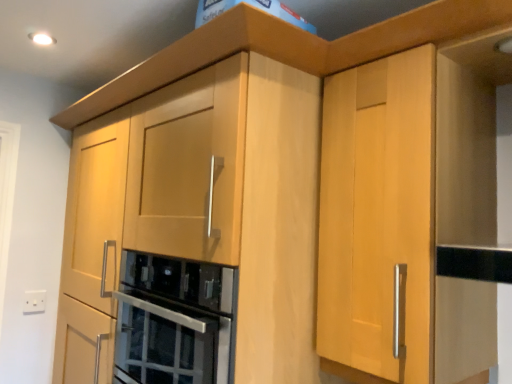
What do you see at coordinates (34, 301) in the screenshot?
I see `white plastic electric outlet at lower left` at bounding box center [34, 301].

At what (x,y) coordinates should I click in order to perform the action: click on white plastic electric outlet at lower left. Please return your answer as a coordinate pair (x, y). The width and height of the screenshot is (512, 384). Looking at the image, I should click on (34, 301).

What do you see at coordinates (175, 321) in the screenshot?
I see `stainless steel oven at center` at bounding box center [175, 321].

The width and height of the screenshot is (512, 384). Find the location of `stainless steel oven at center`. stainless steel oven at center is located at coordinates (175, 321).

Find the location of a particular element. white plastic electric outlet at lower left is located at coordinates (34, 301).

Is white plastic electric outlet at lower left to the left or to the right of stainless steel oven at center in the image?

white plastic electric outlet at lower left is to the left of stainless steel oven at center.

Which object is closer to the camera, white plastic electric outlet at lower left or stainless steel oven at center?

stainless steel oven at center is closer to the camera.

Does point (35, 296) come in front of point (150, 376)?

No, (35, 296) is further to viewer.

From the image's perspective, which object appears higher, white plastic electric outlet at lower left or stainless steel oven at center?

stainless steel oven at center is shown above in the image.

Consider the image. From a real-world perspective, between white plastic electric outlet at lower left and stainless steel oven at center, who is vertically higher?

stainless steel oven at center is physically above.

Considering the sizes of objects white plastic electric outlet at lower left and stainless steel oven at center in the image provided, who is wider, white plastic electric outlet at lower left or stainless steel oven at center?

stainless steel oven at center is wider.

Can you confirm if white plastic electric outlet at lower left is taller than stainless steel oven at center?

No, white plastic electric outlet at lower left is not taller than stainless steel oven at center.

Can you confirm if white plastic electric outlet at lower left is smaller than stainless steel oven at center?

Indeed, white plastic electric outlet at lower left has a smaller size compared to stainless steel oven at center.

Is white plastic electric outlet at lower left positioned beyond the bounds of stainless steel oven at center?

white plastic electric outlet at lower left lies outside stainless steel oven at center's area.

Does white plastic electric outlet at lower left touch stainless steel oven at center?

No, white plastic electric outlet at lower left is not next to stainless steel oven at center.

Is white plastic electric outlet at lower left aimed at stainless steel oven at center?

Yes, white plastic electric outlet at lower left is turned towards stainless steel oven at center.

You are a GUI agent. You are given a task and a screenshot of the screen. Output one action in this format:
    pyautogui.click(x=<x>, y=<y>)
    Task: Click on the electric outlet that appears on the left of stainless steel oven at center
    
    Given the screenshot: What is the action you would take?
    pyautogui.click(x=34, y=301)

Is stainless steel oven at center at the right side of white plastic electric outlet at lower left?

Yes.

Which object is further away from the camera, stainless steel oven at center or white plastic electric outlet at lower left?

white plastic electric outlet at lower left is more distant.

Which point is more distant from viewer, (197, 363) or (40, 309)?

Positioned behind is point (40, 309).

From the image's perspective, who appears lower, stainless steel oven at center or white plastic electric outlet at lower left?

white plastic electric outlet at lower left, from the image's perspective.

From a real-world perspective, relative to white plastic electric outlet at lower left, is stainless steel oven at center vertically above or below?

Clearly, from a real-world perspective, stainless steel oven at center is above white plastic electric outlet at lower left.

Considering the sizes of stainless steel oven at center and white plastic electric outlet at lower left in the image, is stainless steel oven at center wider or thinner than white plastic electric outlet at lower left?

Considering their sizes, stainless steel oven at center looks broader than white plastic electric outlet at lower left.

Considering the relative sizes of stainless steel oven at center and white plastic electric outlet at lower left in the image provided, is stainless steel oven at center shorter than white plastic electric outlet at lower left?

Incorrect, the height of stainless steel oven at center does not fall short of that of white plastic electric outlet at lower left.

Based on the photo, based on their sizes in the image, would you say stainless steel oven at center is bigger or smaller than white plastic electric outlet at lower left?

stainless steel oven at center is bigger than white plastic electric outlet at lower left.

Is stainless steel oven at center not within white plastic electric outlet at lower left?

stainless steel oven at center lies outside white plastic electric outlet at lower left's area.

Would you say stainless steel oven at center is a long distance from white plastic electric outlet at lower left?

stainless steel oven at center is near white plastic electric outlet at lower left, not far away.

Does stainless steel oven at center turn towards white plastic electric outlet at lower left?

No, stainless steel oven at center is not facing towards white plastic electric outlet at lower left.

How different are the orientations of stainless steel oven at center and white plastic electric outlet at lower left in degrees?

The facing directions of stainless steel oven at center and white plastic electric outlet at lower left are 90.1 degrees apart.

You are a GUI agent. You are given a task and a screenshot of the screen. Output one action in this format:
    pyautogui.click(x=<x>, y=<y>)
    Task: Click on the home appliance above the white plastic electric outlet at lower left (from a real-world perspective)
    
    Given the screenshot: What is the action you would take?
    pyautogui.click(x=175, y=321)

The width and height of the screenshot is (512, 384). What are the coordinates of `home appliance that appears in front of the white plastic electric outlet at lower left` in the screenshot? It's located at pos(175,321).

The image size is (512, 384). Find the location of `electric outlet that is under the stainless steel oven at center (from a real-world perspective)`. electric outlet that is under the stainless steel oven at center (from a real-world perspective) is located at coordinates (34, 301).